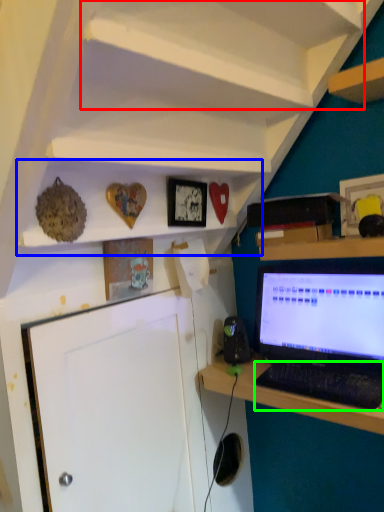
Question: Which object is positioned closest to shelf (highlighted by a red box)? Select from shelf (highlighted by a blue box) and computer keyboard (highlighted by a green box).

Choices:
 (A) shelf
 (B) computer keyboard

Answer: (A)